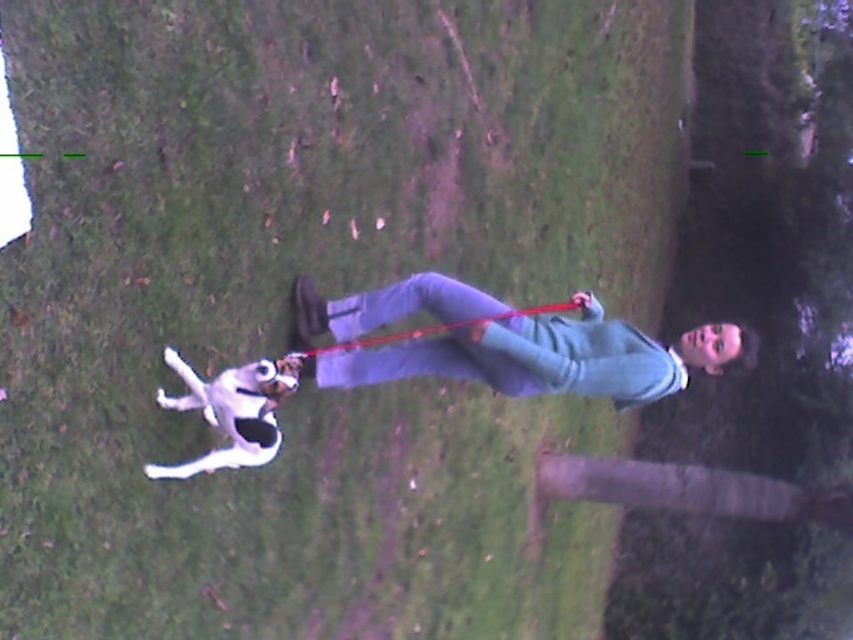
Which is behind, point (698, 365) or point (682, 381)?

Point (698, 365)

Which of these two, denim pants at center or black fabric neckband at center, stands taller?

Standing taller between the two is denim pants at center.

Locate an element on the screen. The width and height of the screenshot is (853, 640). denim pants at center is located at coordinates (523, 358).

Locate an element on the screen. This screenshot has height=640, width=853. denim pants at center is located at coordinates (523, 358).

Is denim pants at center above black fabric leash at center?

No.

Locate an element on the screen. The image size is (853, 640). denim pants at center is located at coordinates (523, 358).

Is black fabric leash at center wider than black fabric neckband at center?

Yes, black fabric leash at center is wider than black fabric neckband at center.

Is black fabric leash at center positioned at the back of black fabric neckband at center?

No, black fabric leash at center is closer to the viewer.

Does point (384, 340) lie in front of point (674, 358)?

No, (384, 340) is further to viewer.

I want to click on black fabric leash at center, so click(x=436, y=328).